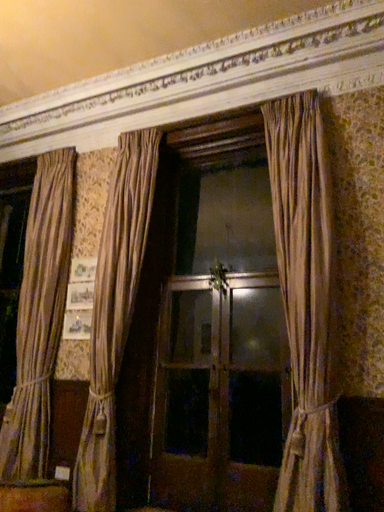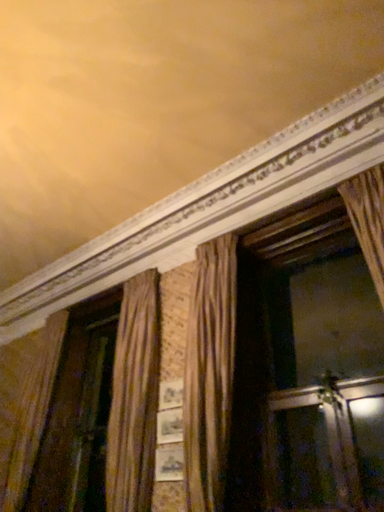
Question: How did the camera likely rotate when shooting the video?

Choices:
 (A) rotated left
 (B) rotated right

Answer: (A)